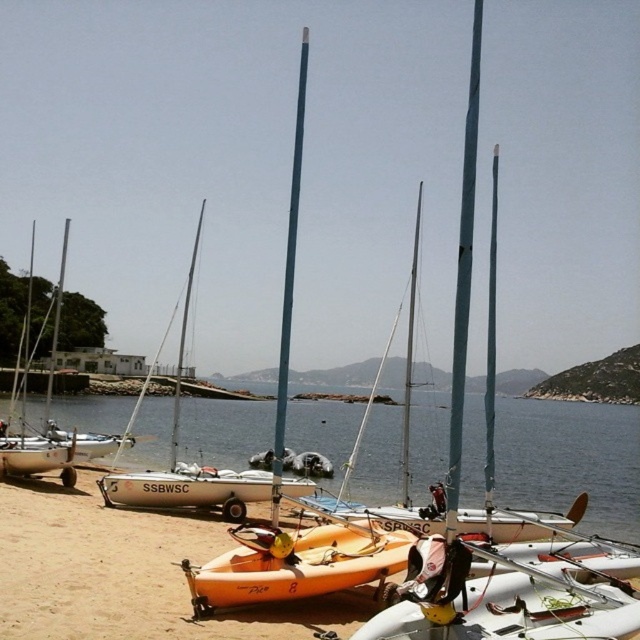
Consider the image. Is the position of clear blue water at center more distant than that of white matte sailboat at center?

Yes, clear blue water at center is further from the viewer.

Between clear blue water at center and white matte sailboat at center, which one is positioned lower?

clear blue water at center

Does point (529, 468) lie behind point (177, 464)?

Yes.

The image size is (640, 640). What are the coordinates of `clear blue water at center` in the screenshot? It's located at (570, 460).

Does white matte sailboat at center have a lesser width compared to white matte mast at left?

Yes, white matte sailboat at center is thinner than white matte mast at left.

Is the position of white matte sailboat at center more distant than that of white matte mast at left?

No, white matte sailboat at center is in front of white matte mast at left.

Who is more distant from viewer, (140, 474) or (52, 326)?

The point (52, 326) is behind.

I want to click on white matte sailboat at center, so click(188, 465).

Is orange matte kayak at center to the right of white matte mast at left from the viewer's perspective?

Correct, you'll find orange matte kayak at center to the right of white matte mast at left.

I want to click on orange matte kayak at center, so click(x=296, y=564).